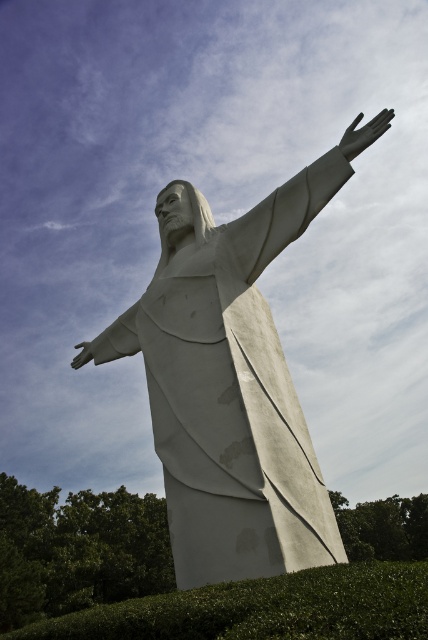
You are a landscape architect designing a garden path that needs to pass between the white marble statue at center and the green leafy hedge at lower center. Based on their positions, which direction should the path be placed to avoid both obstacles?

The white marble statue at center is located above the green leafy hedge at lower center, so the path should be placed either to the left or right side of both objects to avoid them.

You are a landscape architect designing a garden path that needs to pass between the white marble statue at center and the green leafy hedge at lower center. Based on their widths, which object requires more space for the path to ensure it doesn not get blocked?

The green leafy hedge at lower center requires more space for the path since its width is greater than the white marble statue at center.

You are standing at the camera position and want to take a photo of the white marble statue at center. If your camera has a maximum focus range of 30 feet, will you be able to focus on the statue?

The white marble statue at center is 32.27 feet away from camera, which exceeds the camera maximum focus range of 30 feet. Therefore, the camera cannot focus on the statue.